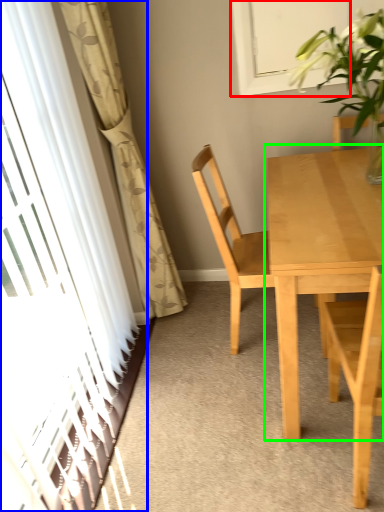
Question: Based on their relative distances, which object is nearer to window (highlighted by a red box)? Choose from screen door (highlighted by a blue box) and kitchen & dining room table (highlighted by a green box).

Choices:
 (A) screen door
 (B) kitchen & dining room table

Answer: (B)